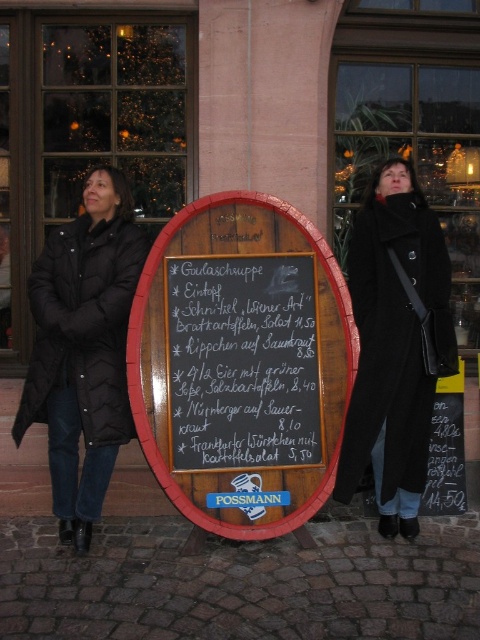
In the scene shown: You are a photographer trying to capture the two points in the image. Which point, point (294, 417) or point (411, 179), is closer to your camera lens?

Point (294, 417) is closer to the viewer than point (411, 179), so it is closer to the camera lens.

You are a tourist in Germany and want to read the menu on the black chalkboard menu at center. However, there is a black chalkboard at center blocking your view. Can you see the menu clearly?

The black chalkboard at center is closer to the viewer than the black chalkboard menu at center, so it is blocking your view of the menu.